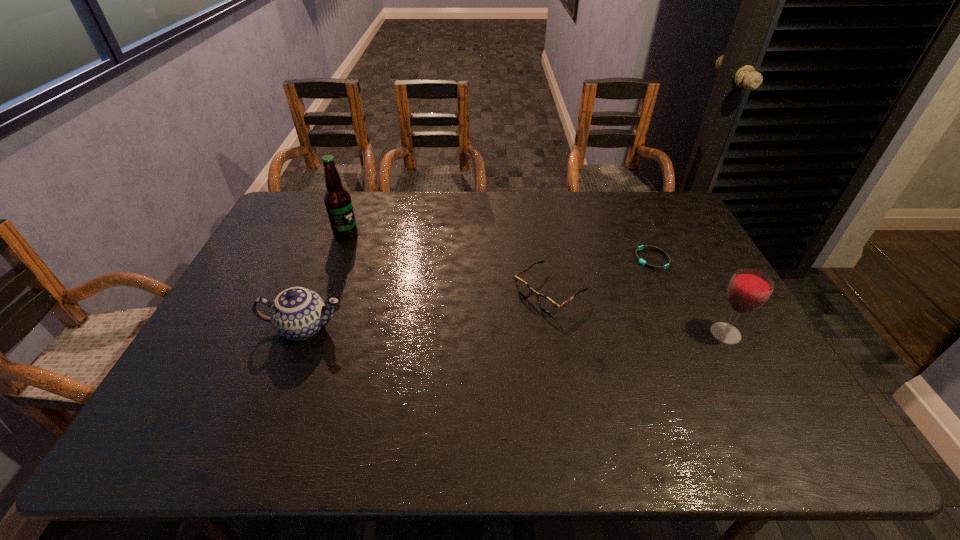
This screenshot has height=540, width=960. Identify the location of object that is the closest to the fourth tallest object. pos(642,262).

I want to click on free space that satisfies the following two spatial constraints: 1. on the front side of the third object from right to left; 2. on the left side of the beer bottle, so click(324, 292).